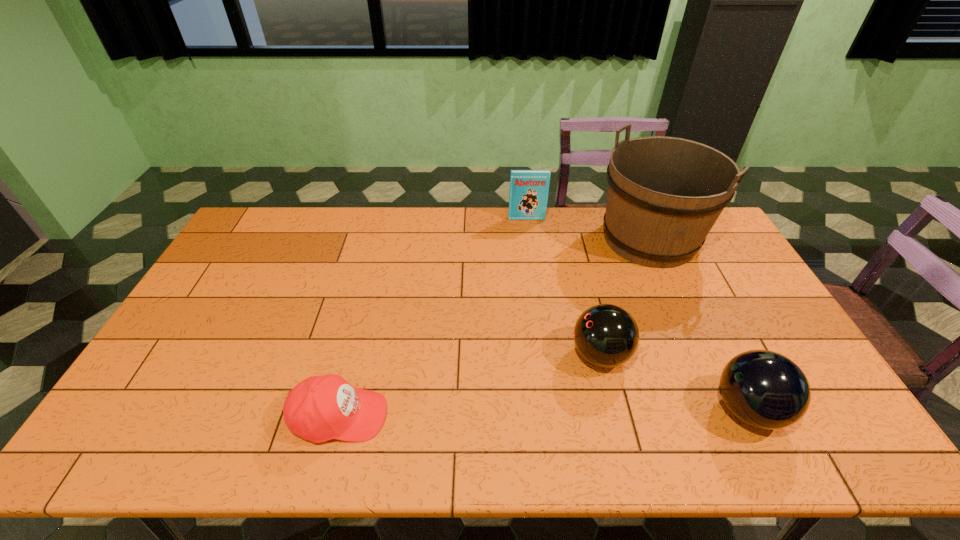
Find the location of a particular element. This screenshot has height=540, width=960. the tallest object is located at coordinates (664, 194).

Image resolution: width=960 pixels, height=540 pixels. What are the coordinates of `book` in the screenshot? It's located at (528, 196).

Locate an element on the screen. This screenshot has width=960, height=540. the right bowling ball is located at coordinates (764, 389).

Where is `the left bowling ball`? This screenshot has height=540, width=960. the left bowling ball is located at coordinates (606, 335).

The image size is (960, 540). Identify the location of the leftmost object. (320, 408).

Image resolution: width=960 pixels, height=540 pixels. In order to click on the shortest object in this screenshot , I will do `click(320, 408)`.

The height and width of the screenshot is (540, 960). In order to click on vacant space located on the left of the bucket in this screenshot , I will do `click(567, 239)`.

Identify the location of vacant space located 0.140m on the front cover of the second object from left to right. (530, 244).

Where is `vacant region located 0.220m on the side of the right bowling ball with the finger holes`? vacant region located 0.220m on the side of the right bowling ball with the finger holes is located at coordinates (622, 409).

The image size is (960, 540). What are the coordinates of `vacant area located 0.230m on the side of the right bowling ball with the finger holes` in the screenshot? It's located at (618, 409).